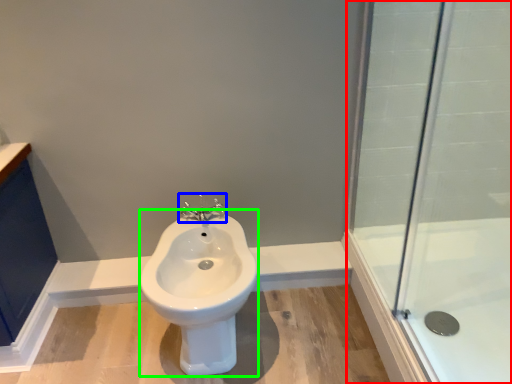
Question: Based on their relative distances, which object is nearer to shower door (highlighted by a red box)? Choose from tap (highlighted by a blue box) and bidet (highlighted by a green box).

Choices:
 (A) tap
 (B) bidet

Answer: (B)